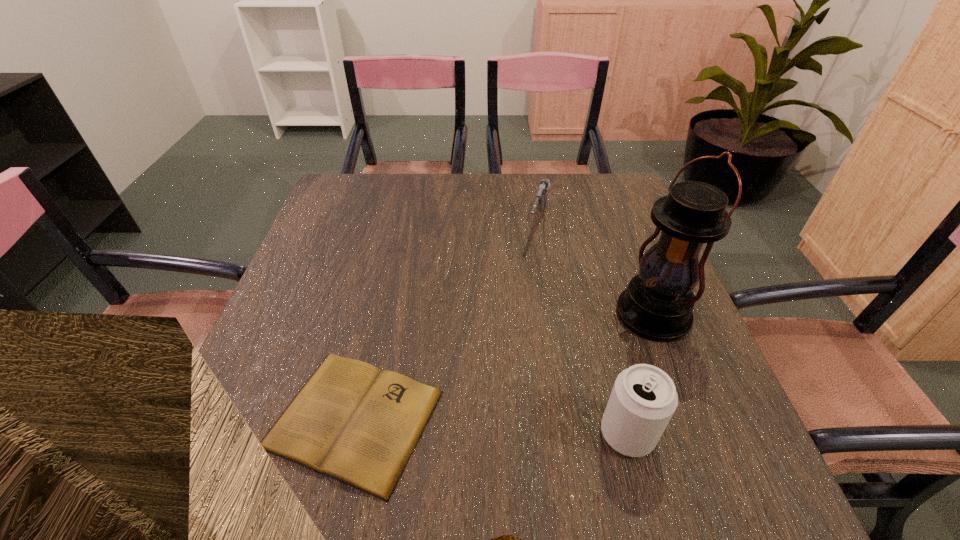
I want to click on lantern located at the right edge, so click(x=657, y=305).

This screenshot has width=960, height=540. I want to click on object situated at the near left corner, so click(351, 421).

Identify the location of object that is positioned at the near right corner. The image size is (960, 540). (643, 399).

Locate an element on the screen. free space at the far edge of the desktop is located at coordinates (562, 211).

Where is `free space at the left edge of the desktop`? The height and width of the screenshot is (540, 960). free space at the left edge of the desktop is located at coordinates (350, 251).

Locate an element on the screen. blank space at the right edge of the desktop is located at coordinates (592, 234).

Where is `vacant space at the far left corner of the desktop`? vacant space at the far left corner of the desktop is located at coordinates (341, 196).

In order to click on vacant space at the far right corner of the desktop in this screenshot , I will do 616,190.

Identify the location of empty space that is in between the leftmost object and the second shortest object. (446, 321).

Where is `empty space that is in between the second farthest object and the gun`? The height and width of the screenshot is (540, 960). empty space that is in between the second farthest object and the gun is located at coordinates (595, 269).